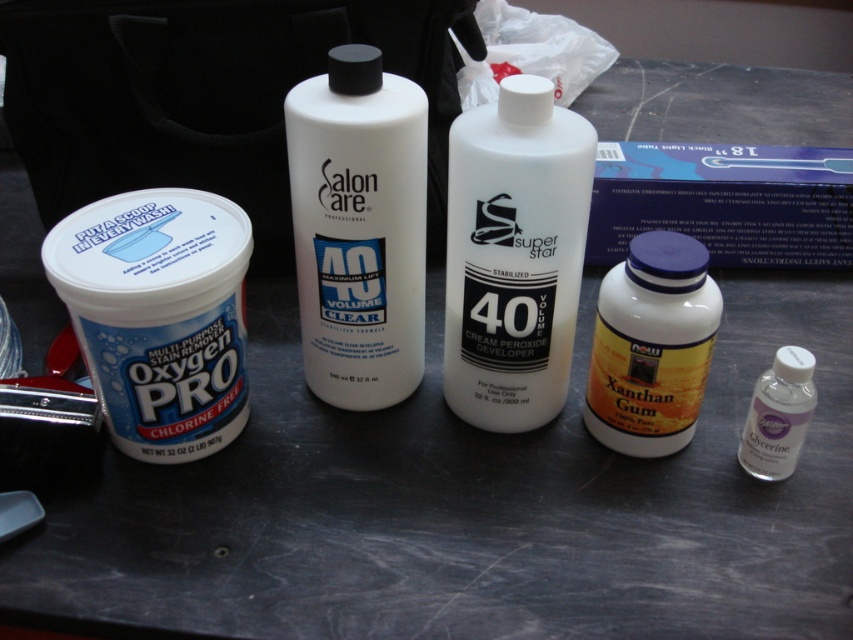
What is the position of the point at coordinates (160, 316) in relation to the white matte container at left?

The point at coordinates (160, 316) is located on the white matte container at left.